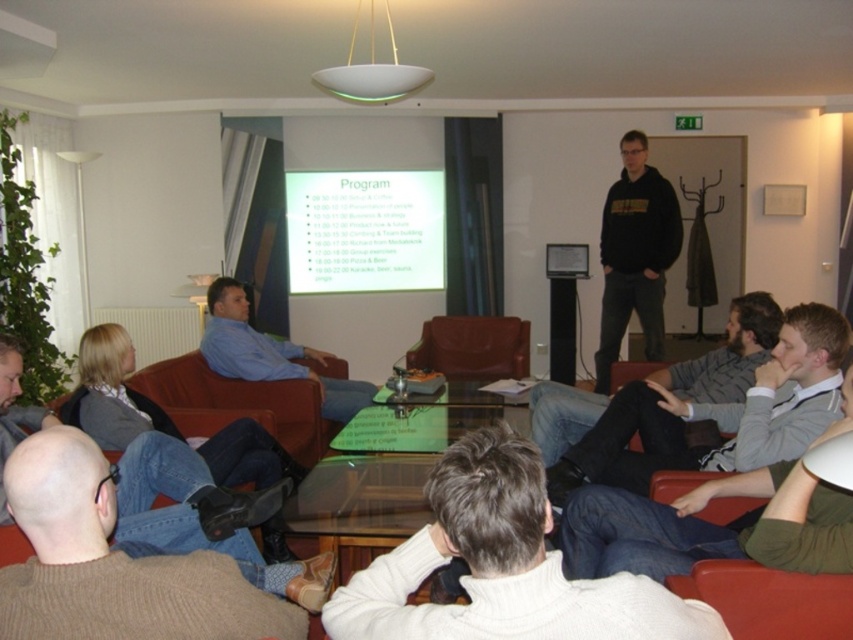
Based on the photo, who is more forward, (381, 266) or (628, 177)?

Point (628, 177) is in front.

The height and width of the screenshot is (640, 853). What are the coordinates of `white glossy projection screen at upper center` in the screenshot? It's located at (364, 230).

Who is higher up, gray sweater at lower right or black hoodie at center?

black hoodie at center

Who is positioned more to the right, gray sweater at lower right or black hoodie at center?

black hoodie at center is more to the right.

Who is more forward, (805, 422) or (636, 264)?

Point (805, 422) is in front.

The height and width of the screenshot is (640, 853). I want to click on gray sweater at lower right, so click(x=717, y=416).

Which is below, brown knitted sweater at lower left or white glossy projection screen at upper center?

brown knitted sweater at lower left is below.

This screenshot has height=640, width=853. Describe the element at coordinates (114, 563) in the screenshot. I see `brown knitted sweater at lower left` at that location.

Who is more distant from viewer, (57, 596) or (431, 244)?

The point (431, 244) is more distant.

Image resolution: width=853 pixels, height=640 pixels. What are the coordinates of `brown knitted sweater at lower left` in the screenshot? It's located at (114, 563).